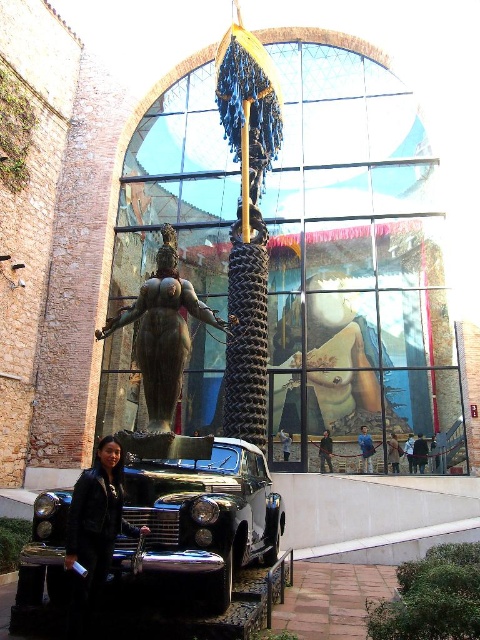
From the picture: Can you confirm if shiny chrome car at center is thinner than bronze statue at center?

Yes, shiny chrome car at center is thinner than bronze statue at center.

Based on the photo, between shiny chrome car at center and bronze statue at center, which one is positioned higher?

bronze statue at center is above.

At what (x,y) coordinates should I click in order to perform the action: click on shiny chrome car at center. Please return your answer as a coordinate pair (x, y). The width and height of the screenshot is (480, 640). Looking at the image, I should click on (200, 518).

You are a GUI agent. You are given a task and a screenshot of the screen. Output one action in this format:
    pyautogui.click(x=<x>, y=<y>)
    Task: Click on the shiny chrome car at center
    Image resolution: width=480 pixels, height=640 pixels.
    Given the screenshot: What is the action you would take?
    pyautogui.click(x=200, y=518)

Can you confirm if bronze statue at center is shorter than black leather jacket at lower left?

No.

Is point (216, 324) positioned in front of point (141, 525)?

No, it is behind (141, 525).

The width and height of the screenshot is (480, 640). Describe the element at coordinates (163, 332) in the screenshot. I see `bronze statue at center` at that location.

Where is `bronze statue at center`? bronze statue at center is located at coordinates (163, 332).

Which is more to the left, shiny chrome car at center or black leather jacket at lower left?

black leather jacket at lower left is more to the left.

Where is `shiny chrome car at center`? shiny chrome car at center is located at coordinates (200, 518).